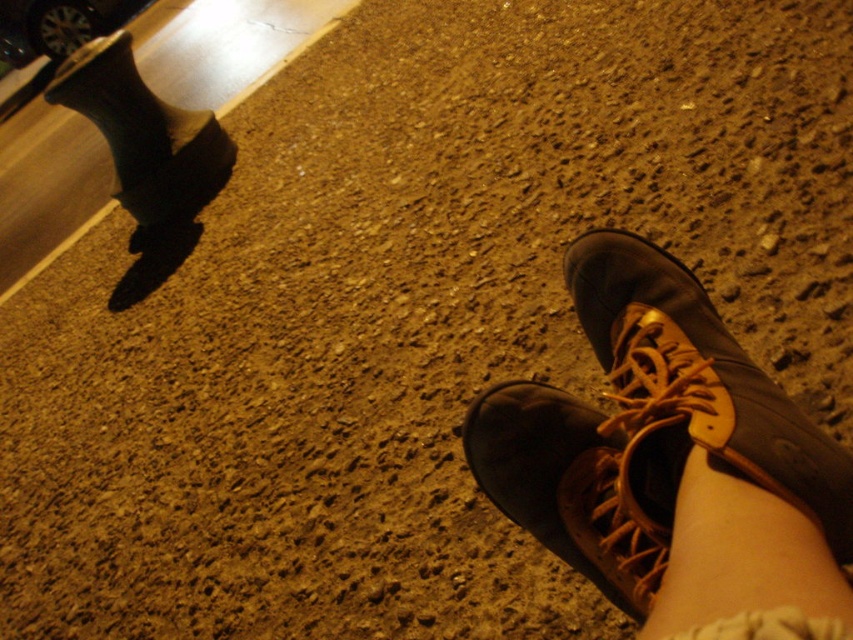
Question: Is brown leather shoe at lower right thinner than brown leather boot at lower right?

Choices:
 (A) yes
 (B) no

Answer: (B)

Question: Estimate the real-world distances between objects in this image. Which object is closer to the leather at lower right?

Choices:
 (A) brown leather boot at lower right
 (B) black rubber curb at upper left

Answer: (A)

Question: Is brown leather boot at lower right positioned in front of shiny chrome car at upper left?

Choices:
 (A) no
 (B) yes

Answer: (B)

Question: Which object is the farthest from the shiny chrome car at upper left?

Choices:
 (A) leather at lower right
 (B) black rubber curb at upper left

Answer: (A)

Question: Can you confirm if black rubber curb at upper left is positioned to the left of leather at lower right?

Choices:
 (A) yes
 (B) no

Answer: (A)

Question: Which is nearer to the leather at lower right?

Choices:
 (A) black rubber curb at upper left
 (B) brown leather boot at lower right

Answer: (B)